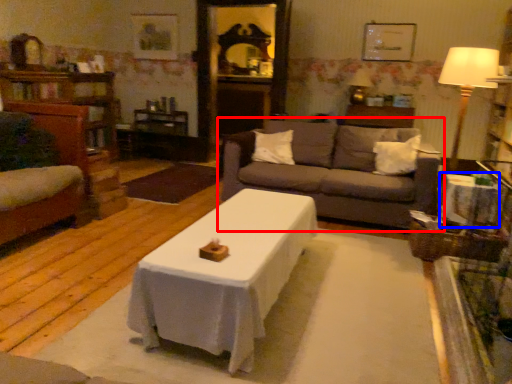
Question: Which object is further to the camera taking this photo, studio couch (highlighted by a red box) or side table (highlighted by a blue box)?

Choices:
 (A) studio couch
 (B) side table

Answer: (A)